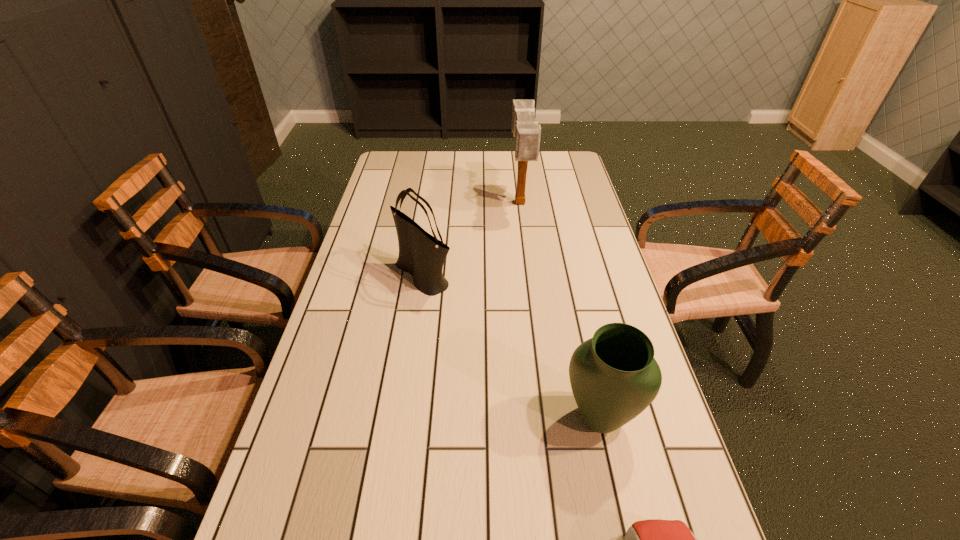
In order to click on free area in between the vase and the shoulder bag in this screenshot , I will do point(512,347).

Locate an element on the screen. the third closest object to the third tallest object is located at coordinates (526, 130).

Select which object appears as the third closest to the second nearest object. Please provide its 2D coordinates. Your answer should be formatted as a tuple, i.e. [(x, y)], where the tuple contains the x and y coordinates of a point satisfying the conditions above.

[(526, 130)]

At what (x,y) coordinates should I click in order to perform the action: click on vacant region that satisfies the following two spatial constraints: 1. on the front side of the third nearest object; 2. on the left side of the second nearest object. Please return your answer as a coordinate pair (x, y). Looking at the image, I should click on (403, 417).